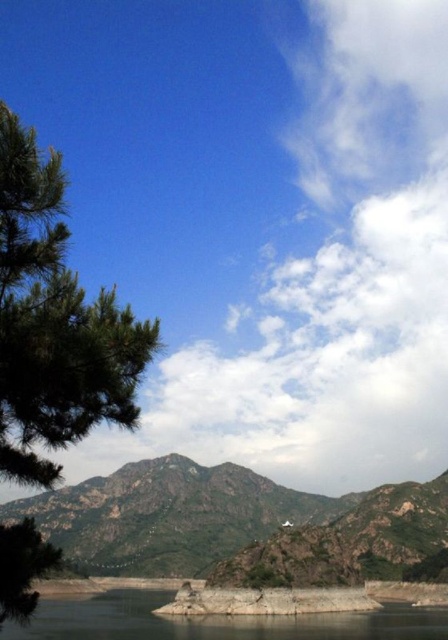
Question: Is green matte tree at left in front of clear water at lower left?

Choices:
 (A) no
 (B) yes

Answer: (B)

Question: Which object appears closest to the camera in this image?

Choices:
 (A) clear water at lower left
 (B) rugged stone mountain at center
 (C) green matte tree at left

Answer: (C)

Question: Does green matte tree at left have a greater width compared to rugged stone mountain at center?

Choices:
 (A) no
 (B) yes

Answer: (A)

Question: Which object appears closest to the camera in this image?

Choices:
 (A) rugged stone mountain at center
 (B) green matte tree at left

Answer: (B)

Question: Which object appears farthest from the camera in this image?

Choices:
 (A) green matte tree at left
 (B) rugged stone mountain at center

Answer: (B)

Question: Does rugged stone mountain at center lie in front of clear water at lower left?

Choices:
 (A) yes
 (B) no

Answer: (B)